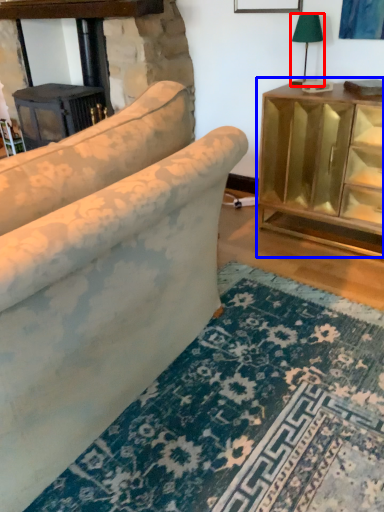
Question: Which object appears closest to the camera in this image, table lamp (highlighted by a red box) or table (highlighted by a blue box)?

Choices:
 (A) table lamp
 (B) table

Answer: (B)